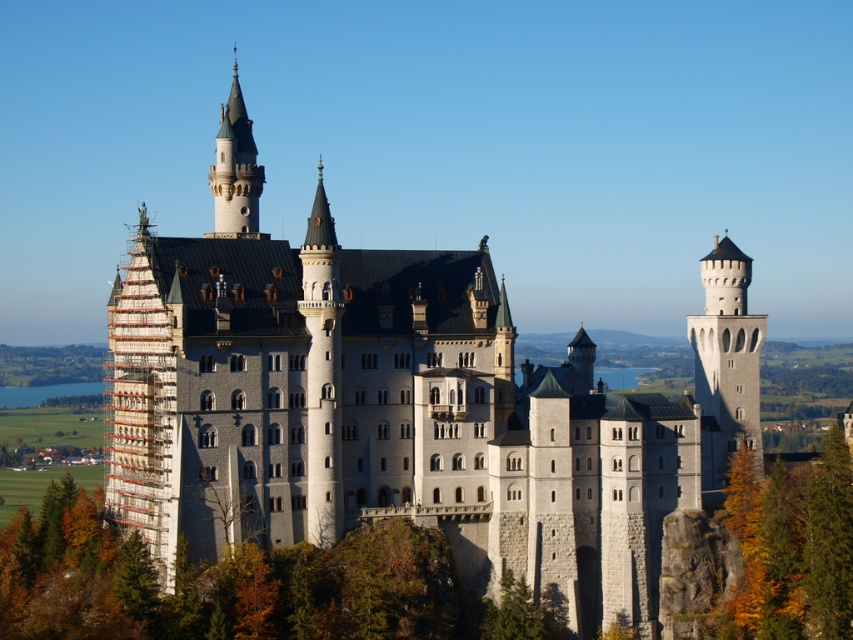
Question: Can you confirm if white stone castle at center is positioned below white stone tower at right?

Choices:
 (A) yes
 (B) no

Answer: (A)

Question: Which of these objects is positioned farthest from the white stone castle at center?

Choices:
 (A) smooth gray stone tower at upper left
 (B) white stone tower at right
 (C) yellow-green leaves at right

Answer: (A)

Question: Considering the relative positions of white stone castle at center and yellow-green leaves at right in the image provided, where is white stone castle at center located with respect to yellow-green leaves at right?

Choices:
 (A) right
 (B) left

Answer: (B)

Question: Which point is farther to the camera?

Choices:
 (A) white stone castle at center
 (B) yellow-green leaves at right

Answer: (B)

Question: Where is yellow-green leaves at right located in relation to smooth gray stone tower at upper left in the image?

Choices:
 (A) above
 (B) below

Answer: (B)

Question: Which point is farther from the camera taking this photo?

Choices:
 (A) (245, 230)
 (B) (573, 481)
 (C) (821, 488)
 (D) (756, 426)

Answer: (D)